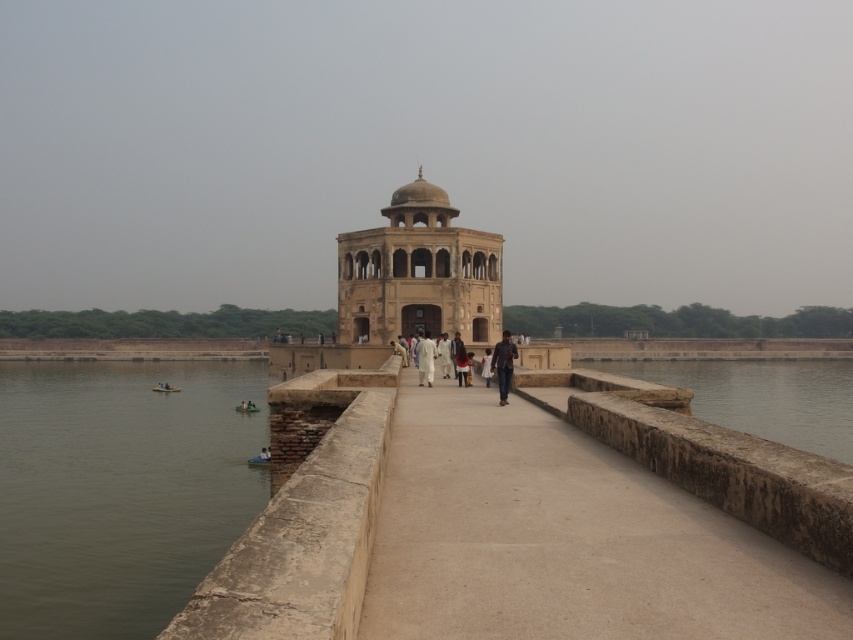
Question: Does greenish water at lower left have a larger size compared to white cotton person at center?

Choices:
 (A) yes
 (B) no

Answer: (A)

Question: Which point appears closest to the camera in this image?

Choices:
 (A) (512, 364)
 (B) (416, 356)
 (C) (357, 259)

Answer: (A)

Question: Where is beige stone palace at center located in relation to dark blue jeans at center in the image?

Choices:
 (A) above
 (B) below

Answer: (A)

Question: Among these objects, which one is nearest to the camera?

Choices:
 (A) white cotton person at center
 (B) greenish water at lower left
 (C) smooth stone pathway at center
 (D) dark blue jeans at center

Answer: (C)

Question: Does greenish water at lower left appear on the left side of white cotton person at center?

Choices:
 (A) no
 (B) yes

Answer: (B)

Question: Which is farther from the smooth stone pathway at center?

Choices:
 (A) dark blue jeans at center
 (B) brown stone water at lower center
 (C) greenish water at lower left
 (D) beige stone palace at center

Answer: (D)